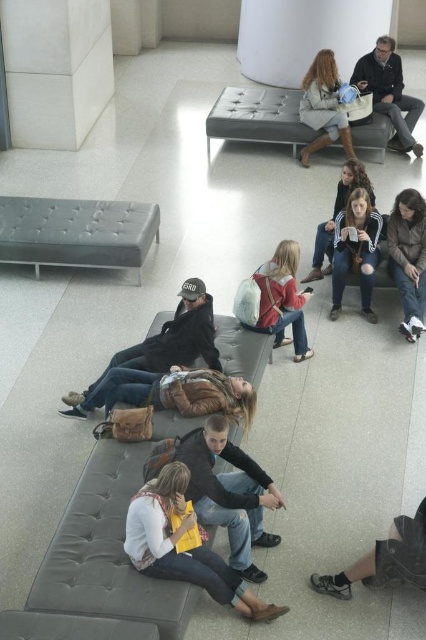
You are a person trying to sit on the matte gray cushioned bench at left. There is a leather brown jacket at center in the way. Can you sit down without moving the jacket?

The leather brown jacket at center is behind the matte gray cushioned bench at left, so you can sit down without moving the jacket because it is not blocking the front of the bench.

You are a janitor in the lobby and need to move the white textured backpack at center and the brown leather jacket at right to the storage room. The storage room is 5 feet away from your current position. Can you carry both items to the storage room without needing to make multiple trips?

The white textured backpack at center and brown leather jacket at right are 4.51 feet apart from each other. Since the storage room is 5 feet away, you can carry both items to the storage room in a single trip as the distance between them is less than the 5 feet required.

Based on the photo, you are standing in the lobby and want to reach the point marked as point (17, 204). If your walking speed is 3 feet per second, how many seconds will it take you to reach that point?

The distance between you and point (17, 204) is 22.18 feet. At a walking speed of 3 feet per second, it would take approximately 7.4 seconds to reach the point.